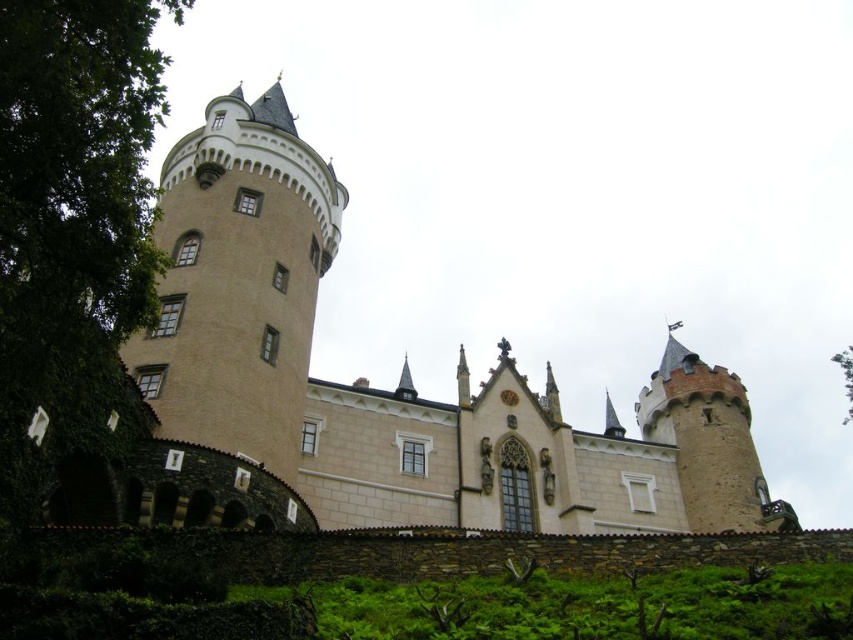
In the scene shown: Is white stone tower at center-left to the right of green leafy tree at upper right from the viewer's perspective?

No, white stone tower at center-left is not to the right of green leafy tree at upper right.

Between white stone tower at center-left and green leafy tree at upper right, which one appears on the right side from the viewer's perspective?

From the viewer's perspective, green leafy tree at upper right appears more on the right side.

This screenshot has height=640, width=853. What are the coordinates of `white stone tower at center-left` in the screenshot? It's located at (238, 282).

Between rustic stone tower at right and green leafy tree at upper right, which one is positioned lower?

green leafy tree at upper right

This screenshot has width=853, height=640. Describe the element at coordinates (708, 442) in the screenshot. I see `rustic stone tower at right` at that location.

Which is in front, point (721, 445) or point (846, 388)?

Point (721, 445) is more forward.

This screenshot has width=853, height=640. What are the coordinates of `rustic stone tower at right` in the screenshot? It's located at (708, 442).

Is point (331, 499) farther from camera compared to point (849, 385)?

That is False.

Which of these two, beige stone castle at center or green leafy tree at upper right, stands shorter?

Standing shorter between the two is green leafy tree at upper right.

The width and height of the screenshot is (853, 640). I want to click on beige stone castle at center, so click(x=399, y=376).